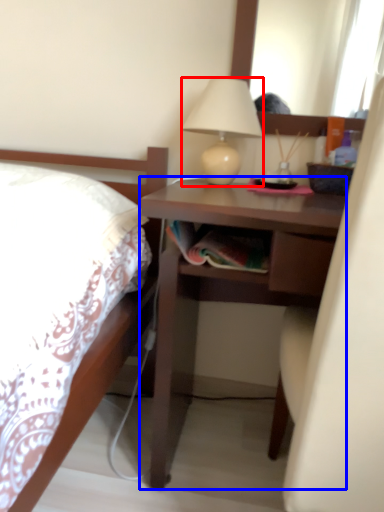
Question: Which of the following is the closest to the observer, lamp (highlighted by a red box) or desk (highlighted by a blue box)?

Choices:
 (A) lamp
 (B) desk

Answer: (B)